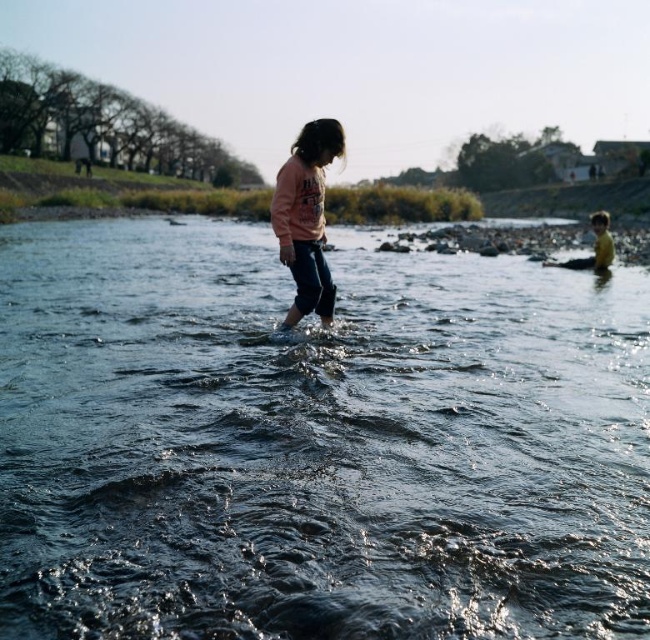
Question: Estimate the real-world distances between objects in this image. Which object is farther from the clear water at center?

Choices:
 (A) pink fleece sweater at center
 (B) yellow rubber boots at right

Answer: (B)

Question: Can you confirm if clear water at center is smaller than yellow rubber boots at right?

Choices:
 (A) yes
 (B) no

Answer: (A)

Question: Where is clear water at center located in relation to pink fleece sweater at center in the image?

Choices:
 (A) right
 (B) left

Answer: (A)

Question: Does clear water at center appear on the left side of yellow rubber boots at right?

Choices:
 (A) no
 (B) yes

Answer: (B)

Question: Which point is closer to the camera?

Choices:
 (A) (604, 232)
 (B) (434, 509)
 (C) (281, 260)

Answer: (B)

Question: Among these objects, which one is nearest to the camera?

Choices:
 (A) pink fleece sweater at center
 (B) yellow rubber boots at right
 (C) clear water at center

Answer: (C)